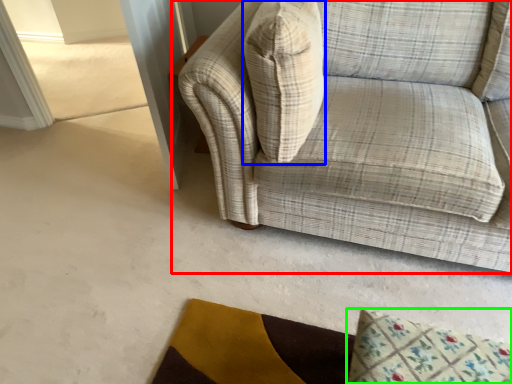
Question: Considering the real-world distances, which object is closest to studio couch (highlighted by a red box)? throw pillow (highlighted by a blue box) or mat (highlighted by a green box).

Choices:
 (A) throw pillow
 (B) mat

Answer: (A)